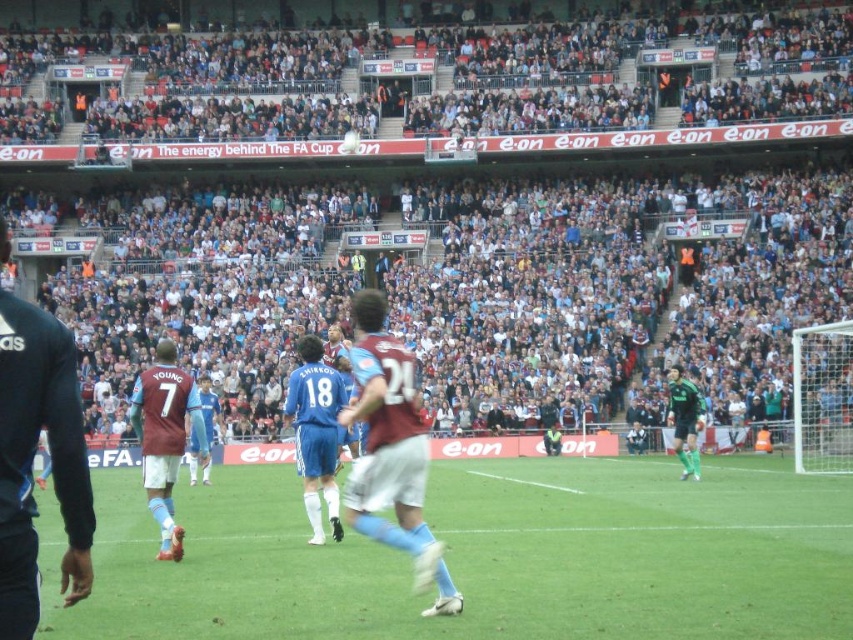
Can you confirm if black synthetic jacket at left is positioned below matte blue shorts at center?

Actually, black synthetic jacket at left is above matte blue shorts at center.

Which is below, black synthetic jacket at left or matte blue shorts at center?

matte blue shorts at center is below.

Between point (18, 422) and point (155, 356), which one is positioned behind?

Positioned behind is point (155, 356).

Locate an element on the screen. black synthetic jacket at left is located at coordinates tap(32, 458).

Does matte blue shorts at center appear under green matte jersey at right?

No.

Is matte blue shorts at center above green matte jersey at right?

Yes.

Measure the distance between matte blue shorts at center and camera.

matte blue shorts at center is 72.29 feet away from camera.

The width and height of the screenshot is (853, 640). I want to click on matte blue shorts at center, so [165, 436].

Where is `blue jersey at center`? The width and height of the screenshot is (853, 640). blue jersey at center is located at coordinates (316, 433).

Describe the element at coordinates (316, 433) in the screenshot. I see `blue jersey at center` at that location.

Measure the distance between point (x=338, y=403) and camera.

Point (x=338, y=403) is 24.50 meters away from camera.

Identify the location of blue jersey at center. pos(316,433).